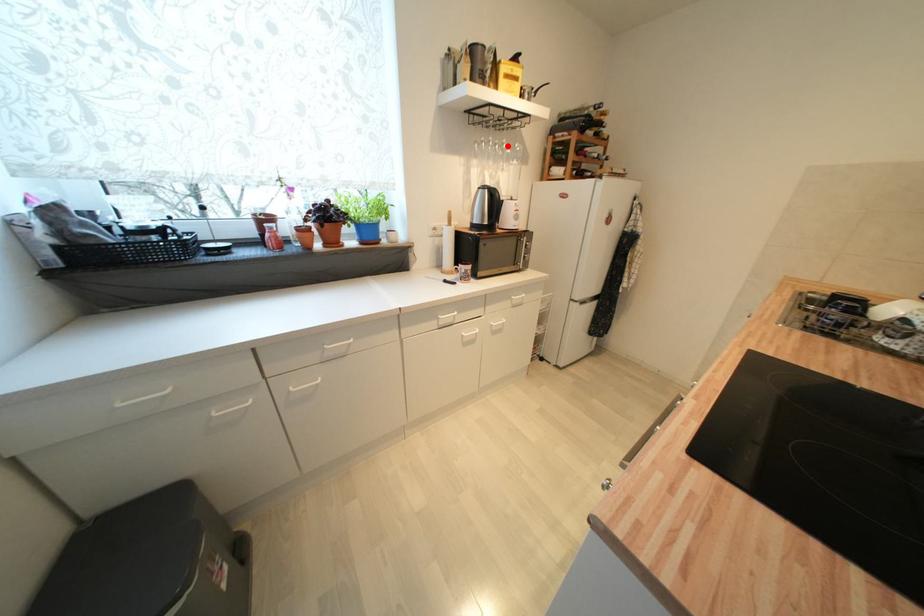
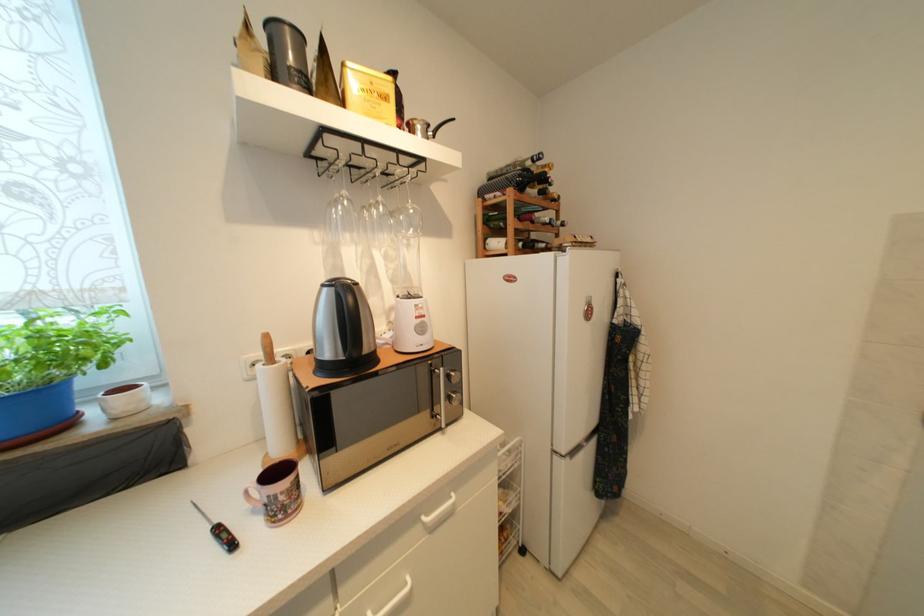
Locate, in the second image, the point that corresponds to the highlighted location in the first image.

(383, 206)